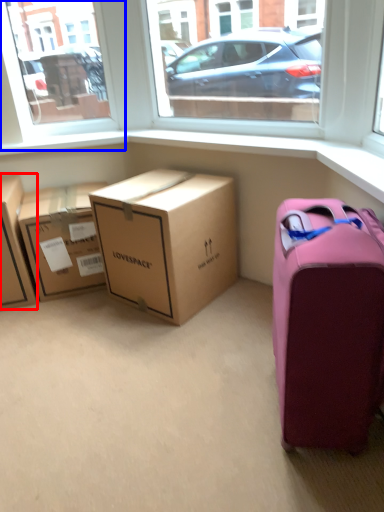
Question: Which of the following is the closest to the observer, box (highlighted by a red box) or window screen (highlighted by a blue box)?

Choices:
 (A) box
 (B) window screen

Answer: (A)